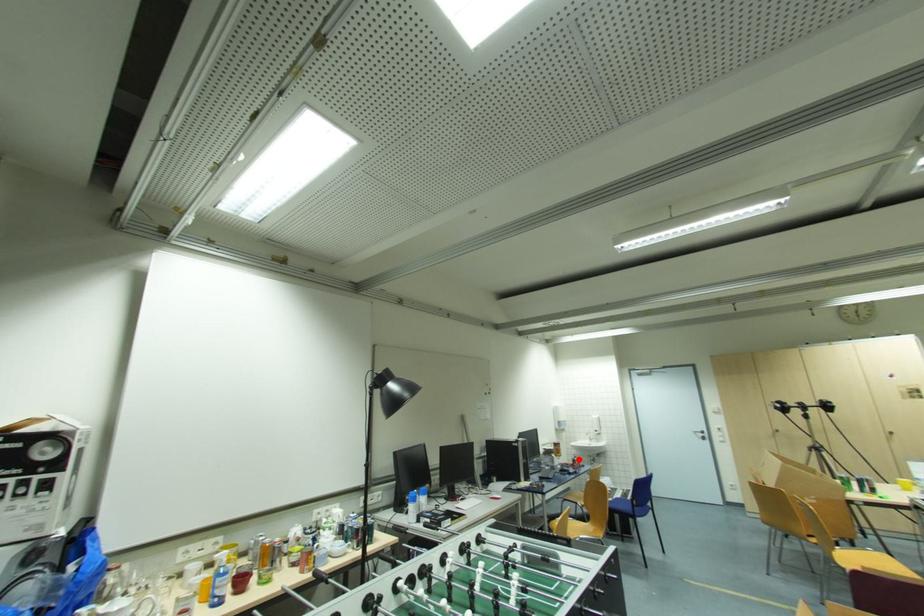
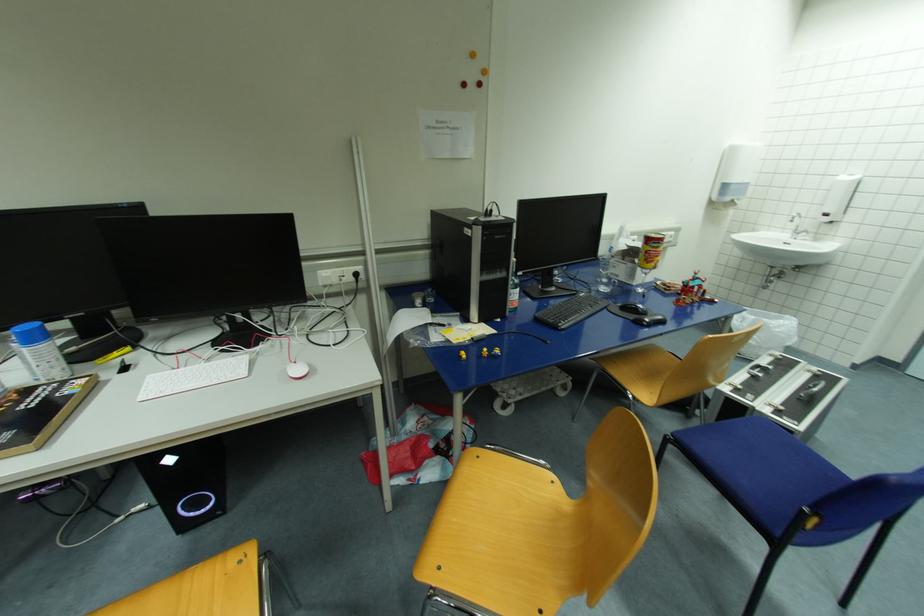
Question: I am providing you with two images of the same scene from different viewpoints. A red point is shown in image1. For the corresponding object point in image2, is it positioned nearer or farther from the camera?

Choices:
 (A) Nearer
 (B) Farther

Answer: (A)